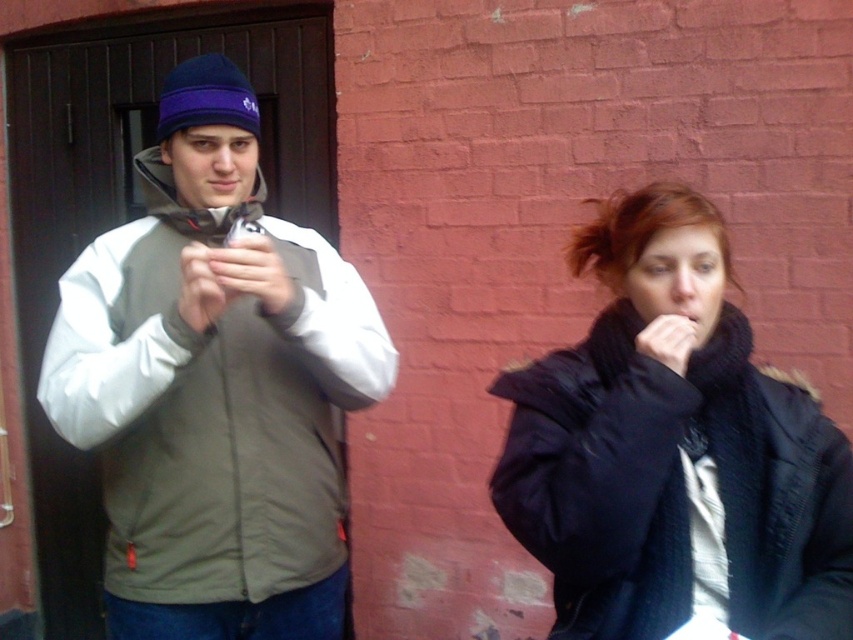
Question: Is olive-green jacket at center below dark blue knit scarf at right?

Choices:
 (A) no
 (B) yes

Answer: (A)

Question: Which of the following is the closest to the observer?

Choices:
 (A) olive-green jacket at center
 (B) dark blue knit scarf at right

Answer: (B)

Question: Does olive-green jacket at center appear under dark blue knit scarf at right?

Choices:
 (A) yes
 (B) no

Answer: (B)

Question: Can you confirm if olive-green jacket at center is smaller than dark blue knit scarf at right?

Choices:
 (A) yes
 (B) no

Answer: (B)